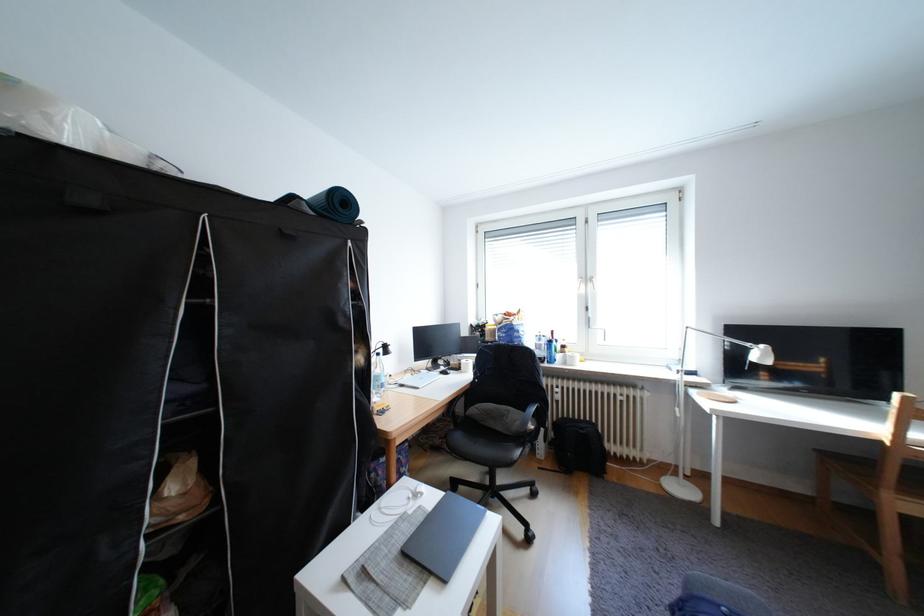
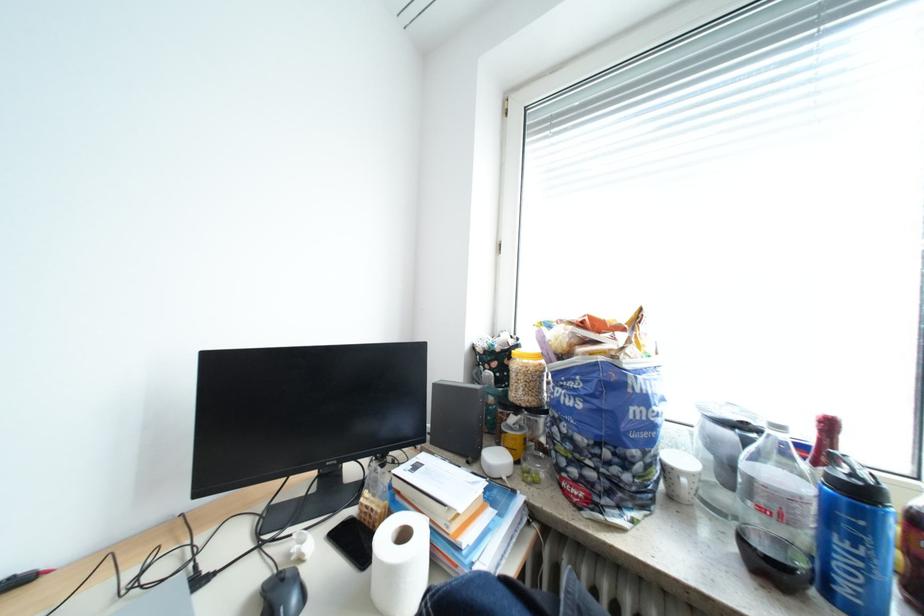
In the second image, find the point that corresponds to [553,345] in the first image.

(807, 499)